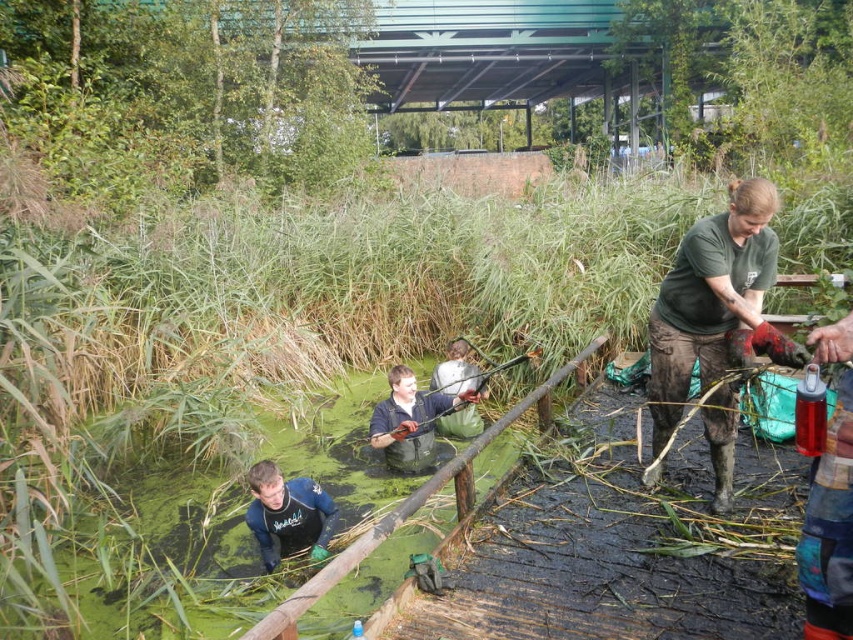
Does green matte shirt at right appear under dark green rubber waders at center?

No, green matte shirt at right is not below dark green rubber waders at center.

Which is above, green matte shirt at right or dark green rubber waders at center?

Positioned higher is green matte shirt at right.

Which is behind, point (740, 280) or point (393, 428)?

The point (393, 428) is behind.

What are the coordinates of `green matte shirt at right` in the screenshot? It's located at (712, 301).

Can you confirm if dark blue wetsuit at lower center is taller than dark green rubber waders at center?

No.

Is dark blue wetsuit at lower center to the right of dark green rubber waders at center from the viewer's perspective?

Incorrect, dark blue wetsuit at lower center is not on the right side of dark green rubber waders at center.

Is point (318, 516) farther from camera compared to point (418, 433)?

No, (318, 516) is closer to viewer.

Where is `dark blue wetsuit at lower center`? The image size is (853, 640). dark blue wetsuit at lower center is located at coordinates (287, 515).

Who is positioned more to the right, green matte shirt at right or dark blue wetsuit at lower center?

From the viewer's perspective, green matte shirt at right appears more on the right side.

I want to click on green matte shirt at right, so click(x=712, y=301).